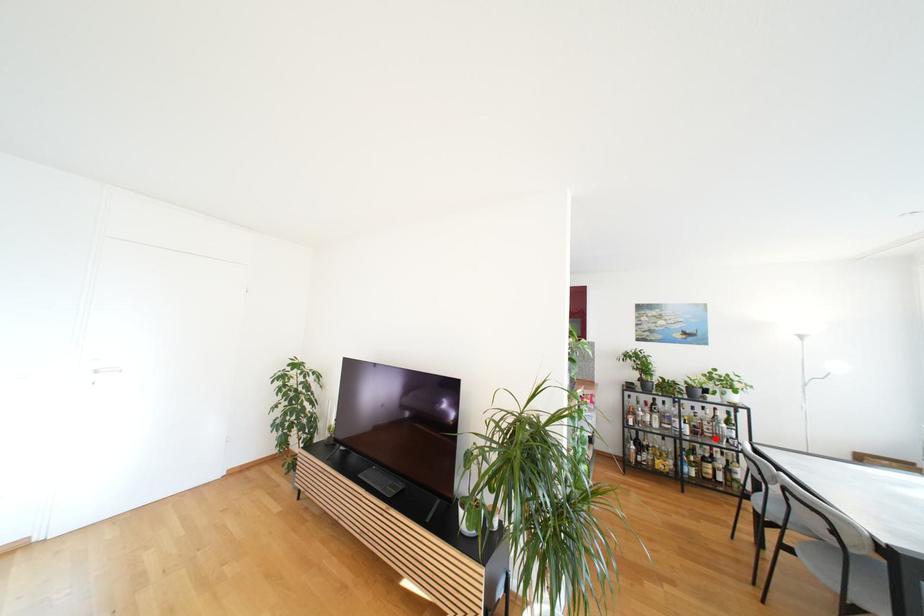
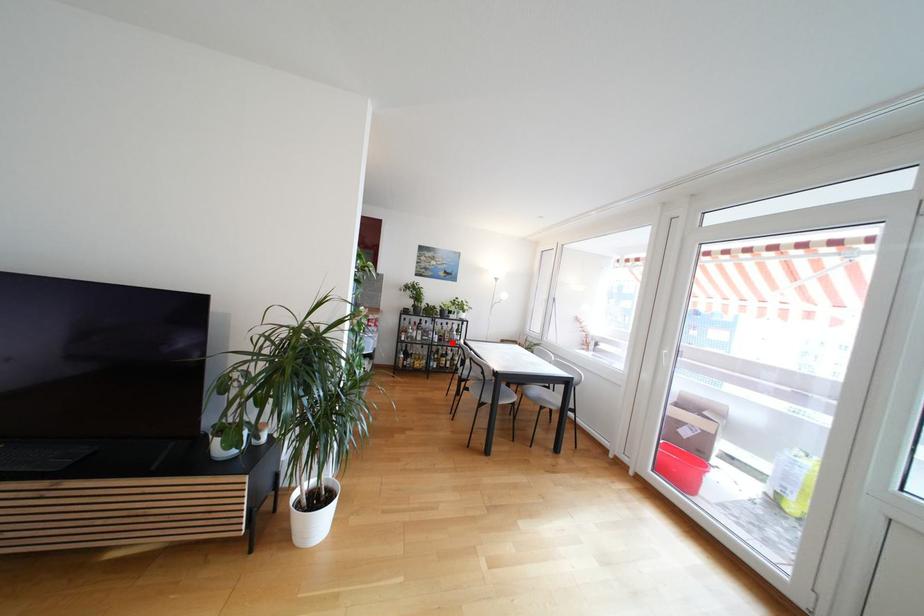
I am providing you with two images of the same scene from different viewpoints. A red point is marked on the first image and another point is marked on the second image. Do the highlighted points in image1 and image2 indicate the same real-world spot?

Yes